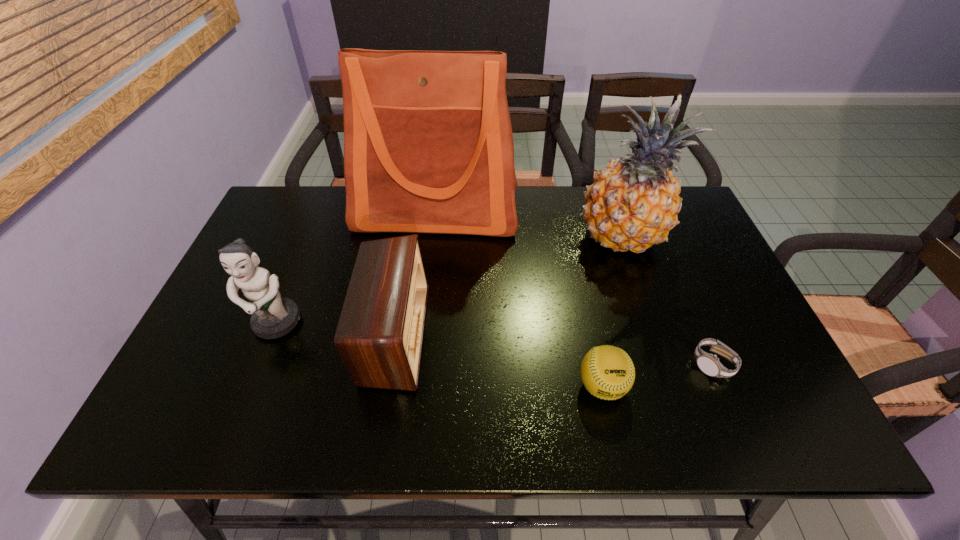
Identify the location of vacant space located 0.170m on the front-facing side of the radio receiver. This screenshot has width=960, height=540. (495, 335).

In order to click on vacant space situated 0.060m on the logo side of the fifth tallest object in this screenshot , I will do `click(613, 437)`.

Locate an element on the screen. The height and width of the screenshot is (540, 960). free space located on the face of the watch is located at coordinates (732, 411).

I want to click on shopping bag located in the far edge section of the desktop, so click(428, 146).

Where is `pineapple that is at the far edge`? The height and width of the screenshot is (540, 960). pineapple that is at the far edge is located at coordinates (633, 203).

Locate an element on the screen. object that is positioned at the near edge is located at coordinates (607, 372).

Image resolution: width=960 pixels, height=540 pixels. Identify the location of object that is positioned at the left edge. (272, 317).

This screenshot has height=540, width=960. What are the coordinates of `pineapple present at the right edge` in the screenshot? It's located at (633, 203).

Identify the location of watch located in the right edge section of the desktop. The height and width of the screenshot is (540, 960). (709, 364).

This screenshot has width=960, height=540. I want to click on object at the far right corner, so click(x=633, y=203).